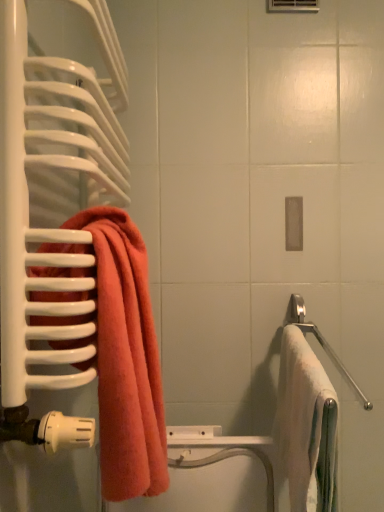
Question: Considering the relative sizes of white soft towel at right, which is the second towel in left-to-right order, and coral terry towel at left, arranged as the first towel when viewed from the left, in the image provided, is white soft towel at right, which is the second towel in left-to-right order, taller than coral terry towel at left, arranged as the first towel when viewed from the left,?

Choices:
 (A) yes
 (B) no

Answer: (B)

Question: Can you confirm if white soft towel at right, which is the second towel in left-to-right order, is smaller than coral terry towel at left, the 2th towel in the right-to-left sequence?

Choices:
 (A) no
 (B) yes

Answer: (A)

Question: Considering the relative sizes of white soft towel at right, the first towel from the right, and coral terry towel at left, arranged as the first towel when viewed from the left, in the image provided, is white soft towel at right, the first towel from the right, shorter than coral terry towel at left, arranged as the first towel when viewed from the left,?

Choices:
 (A) no
 (B) yes

Answer: (B)

Question: Could you tell me if white soft towel at right, which is the second towel in left-to-right order, is facing coral terry towel at left, arranged as the first towel when viewed from the left?

Choices:
 (A) no
 (B) yes

Answer: (A)

Question: Can you confirm if white soft towel at right, the first towel from the right, is positioned to the right of coral terry towel at left, arranged as the first towel when viewed from the left?

Choices:
 (A) no
 (B) yes

Answer: (B)

Question: From a real-world perspective, is coral terry towel at left, arranged as the first towel when viewed from the left, above or below white soft towel at right, the first towel from the right?

Choices:
 (A) above
 (B) below

Answer: (A)

Question: Would you say coral terry towel at left, the 2th towel in the right-to-left sequence, is to the left or to the right of white soft towel at right, the first towel from the right, in the picture?

Choices:
 (A) right
 (B) left

Answer: (B)

Question: Relative to white soft towel at right, the first towel from the right, is coral terry towel at left, arranged as the first towel when viewed from the left, in front or behind?

Choices:
 (A) behind
 (B) front

Answer: (B)

Question: Looking at the image, does coral terry towel at left, the 2th towel in the right-to-left sequence, seem bigger or smaller compared to white soft towel at right, which is the second towel in left-to-right order?

Choices:
 (A) big
 (B) small

Answer: (B)

Question: In terms of height, does satin silver towel bar at right look taller or shorter compared to coral terry towel at left, the 2th towel in the right-to-left sequence?

Choices:
 (A) tall
 (B) short

Answer: (B)

Question: Is satin silver towel bar at right inside the boundaries of coral terry towel at left, the 2th towel in the right-to-left sequence, or outside?

Choices:
 (A) inside
 (B) outside

Answer: (B)

Question: From the image's perspective, relative to coral terry towel at left, the 2th towel in the right-to-left sequence, is satin silver towel bar at right above or below?

Choices:
 (A) below
 (B) above

Answer: (A)

Question: From a real-world perspective, relative to coral terry towel at left, arranged as the first towel when viewed from the left, is satin silver towel bar at right vertically above or below?

Choices:
 (A) above
 (B) below

Answer: (B)

Question: Is point (284, 325) closer or farther from the camera than point (284, 424)?

Choices:
 (A) farther
 (B) closer

Answer: (A)

Question: From a real-world perspective, is satin silver towel bar at right positioned above or below white soft towel at right, the first towel from the right?

Choices:
 (A) above
 (B) below

Answer: (A)